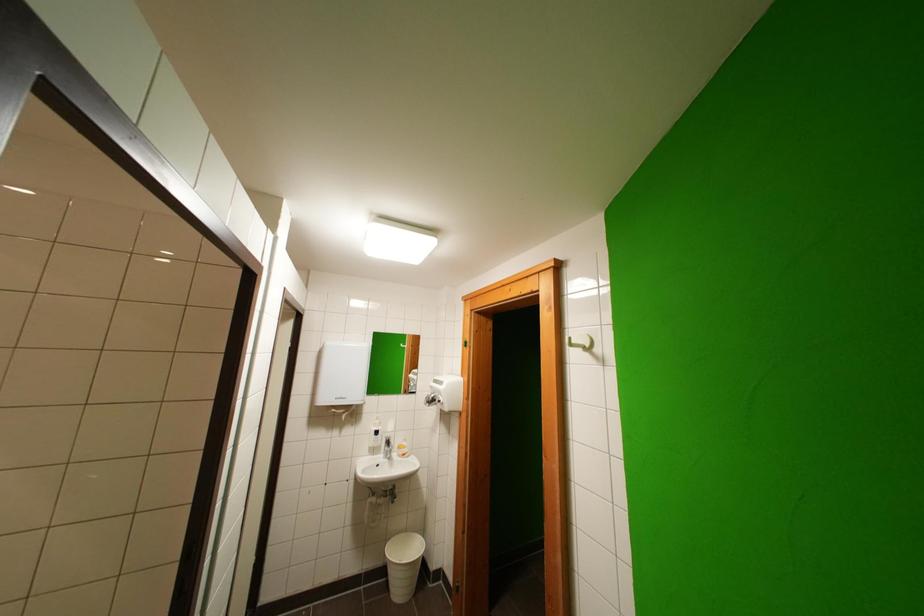
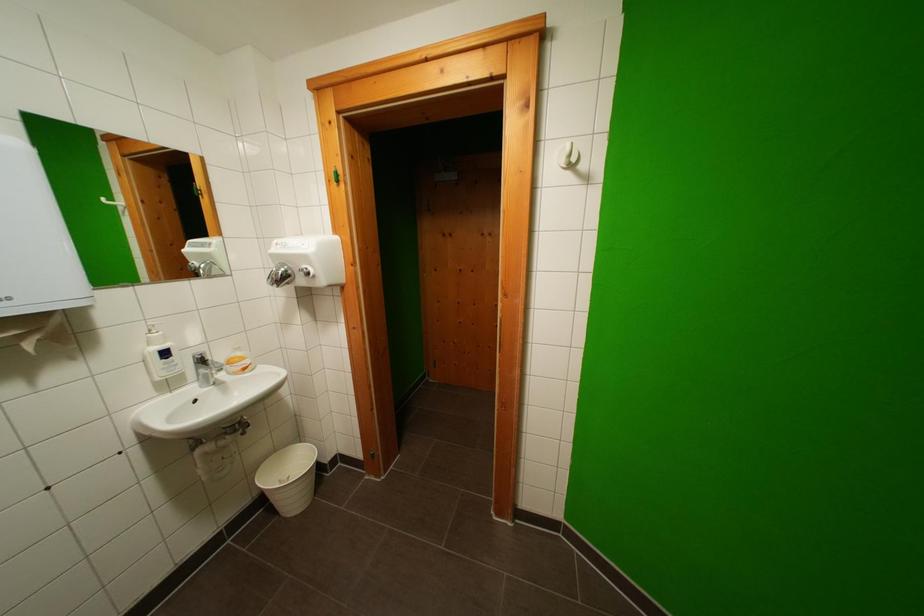
Find the pixel in the second image that matches [359,408] in the first image.

(55, 317)